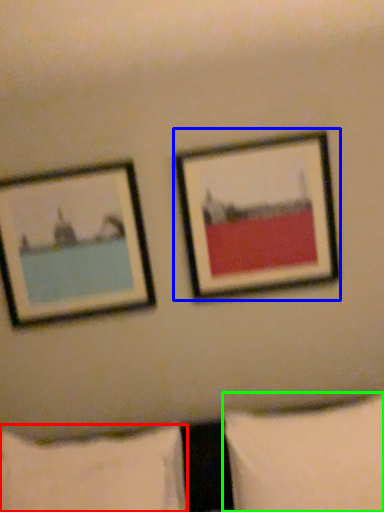
Question: Which object is the closest to the pillow (highlighted by a red box)? Choose among these: picture frame (highlighted by a blue box) or pillow (highlighted by a green box).

Choices:
 (A) picture frame
 (B) pillow

Answer: (B)